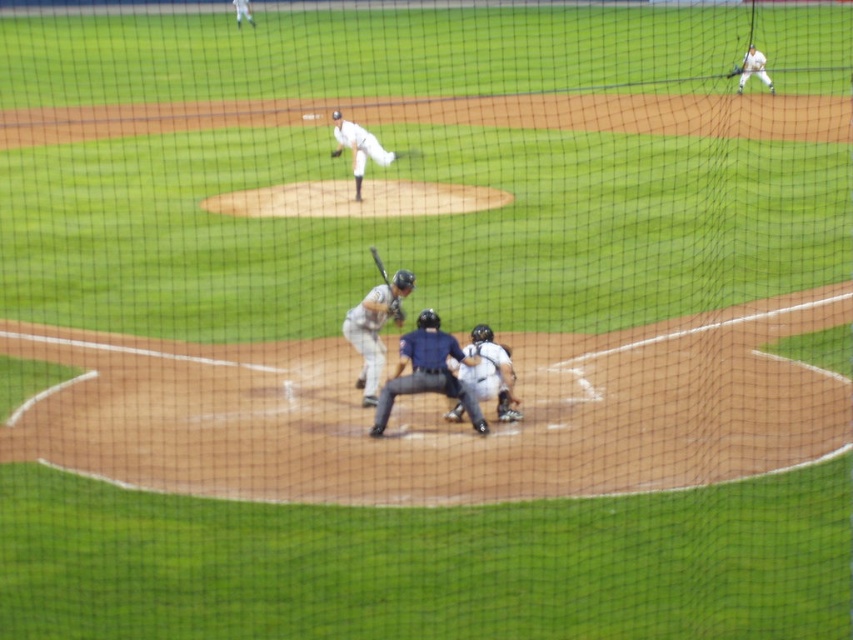
You are a spectator at the baseball game and want to know which player is closer to the ground. Based on the image, which one is positioned lower between the white uniform at center and the white uniformed player at upper right?

The white uniform at center is positioned below the white uniformed player at upper right, so the white uniform at center is closer to the ground.

You are a spectator watching the baseball game and want to locate the catcher. The umpire is standing to your left. Which direction should you turn to find the white matte catcher at center relative to the white uniform at center?

The white matte catcher at center is to the right of the white uniform at center. Since the umpire is to your left, you should turn to your right to locate the white matte catcher at center.

You are a photographer positioned at point (358, 147). You want to capture a photo of the white uniform at center. Is the white uniform at center visible from your current position?

Yes, the white uniform at center is visible from point (358, 147) as it is located at that exact position.